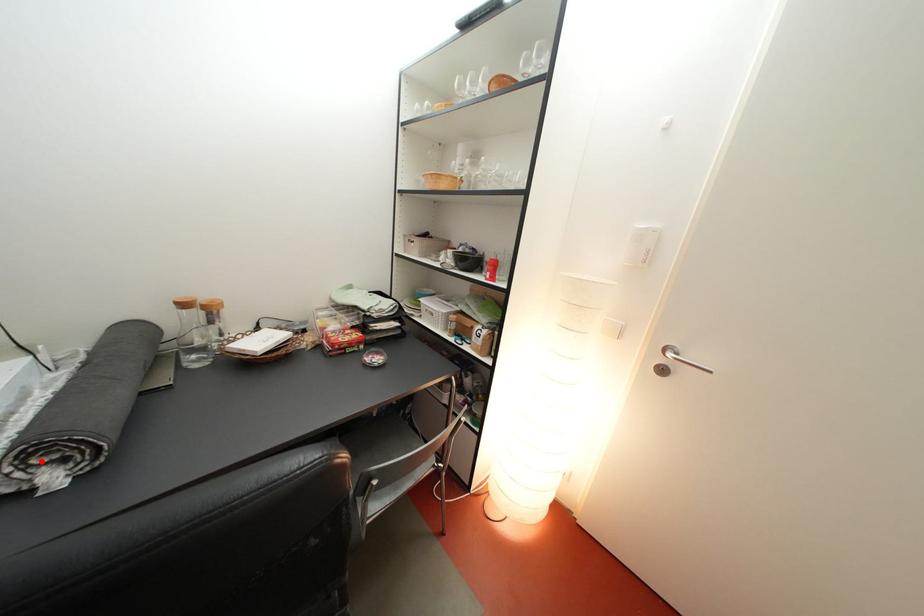
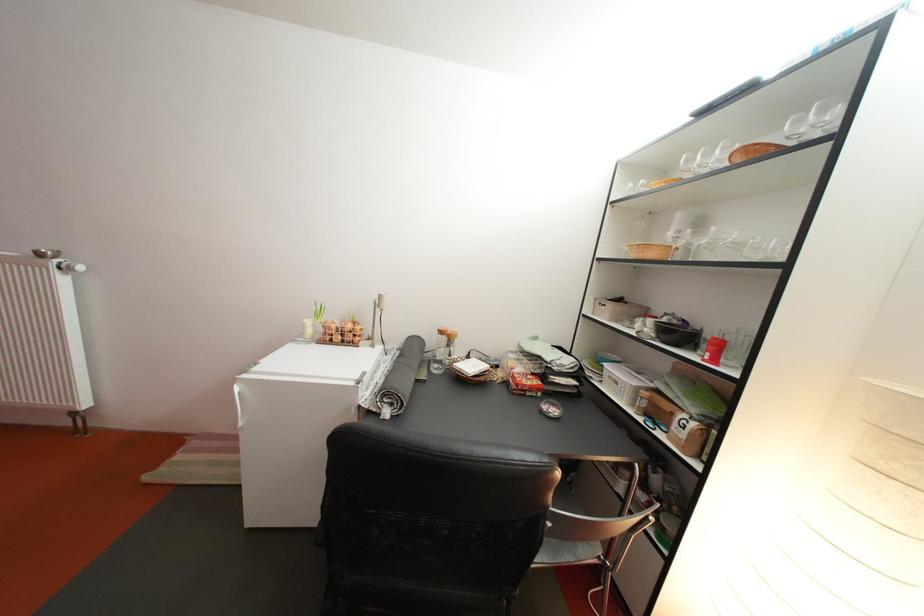
The point at the highlighted location is marked in the first image. Where is the corresponding point in the second image?

(396, 402)